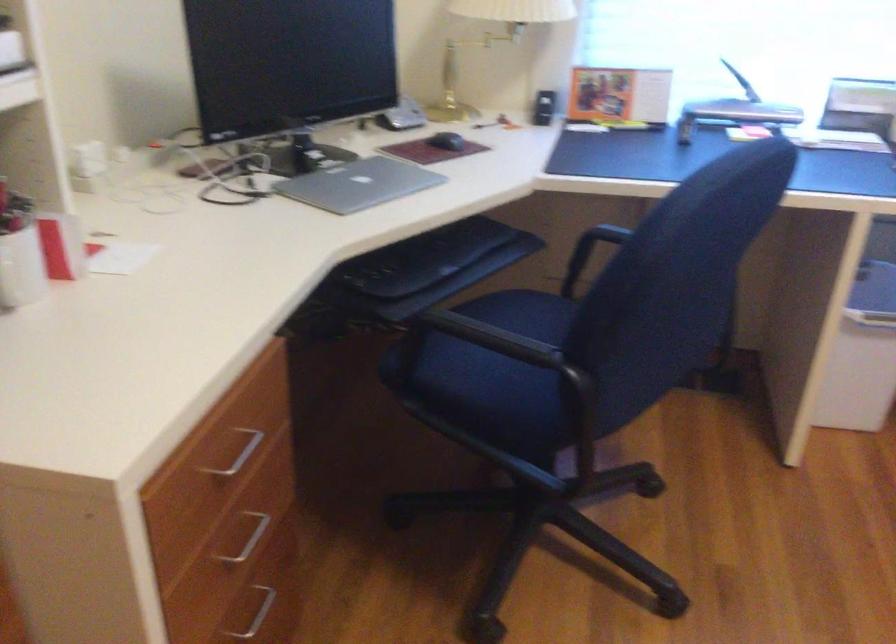
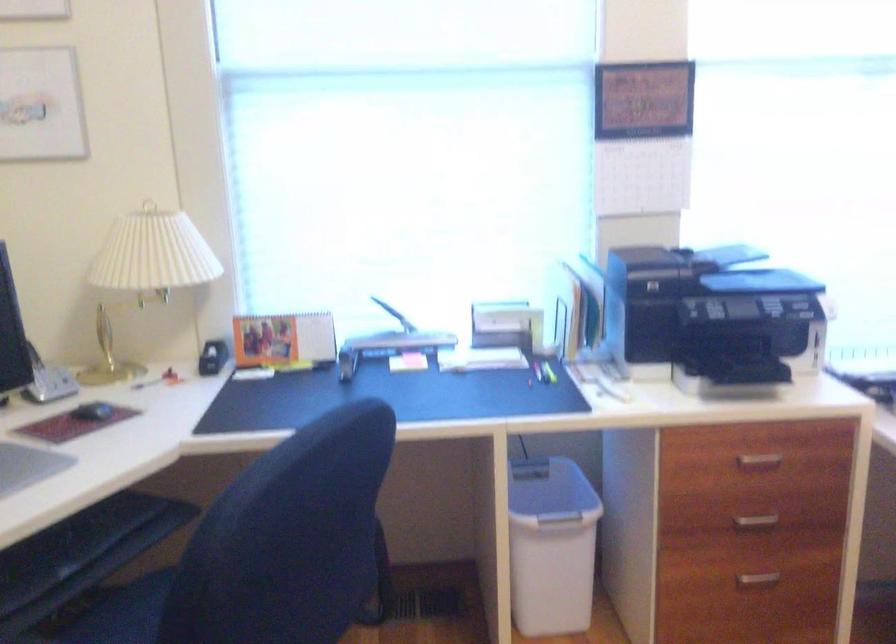
Question: The camera is either moving clockwise (left) or counter-clockwise (right) around the object. The first image is from the beginning of the video and the second image is from the end. Is the camera moving left or right when shooting the video?

Choices:
 (A) Left
 (B) Right

Answer: (A)